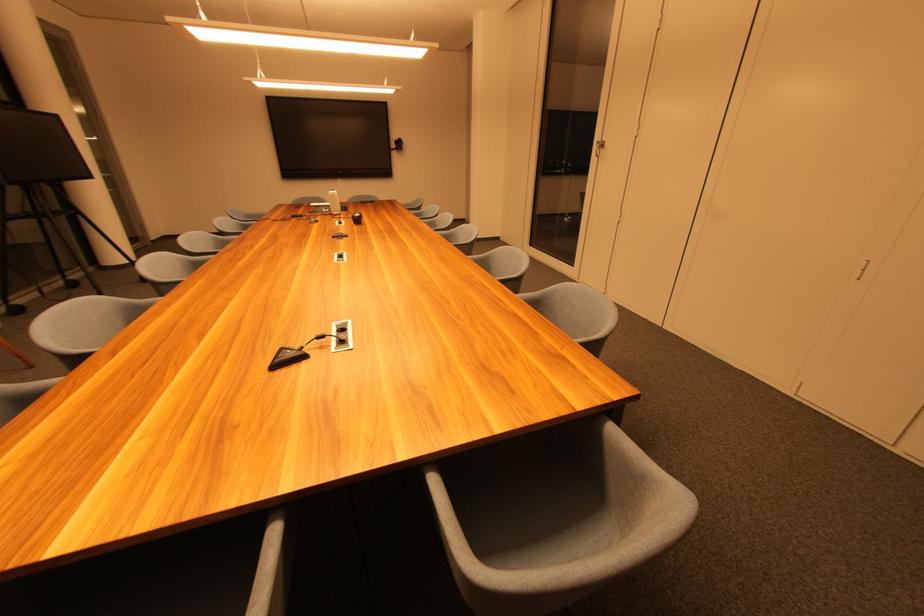
In order to click on silver door handle in this screenshot , I will do `click(599, 147)`.